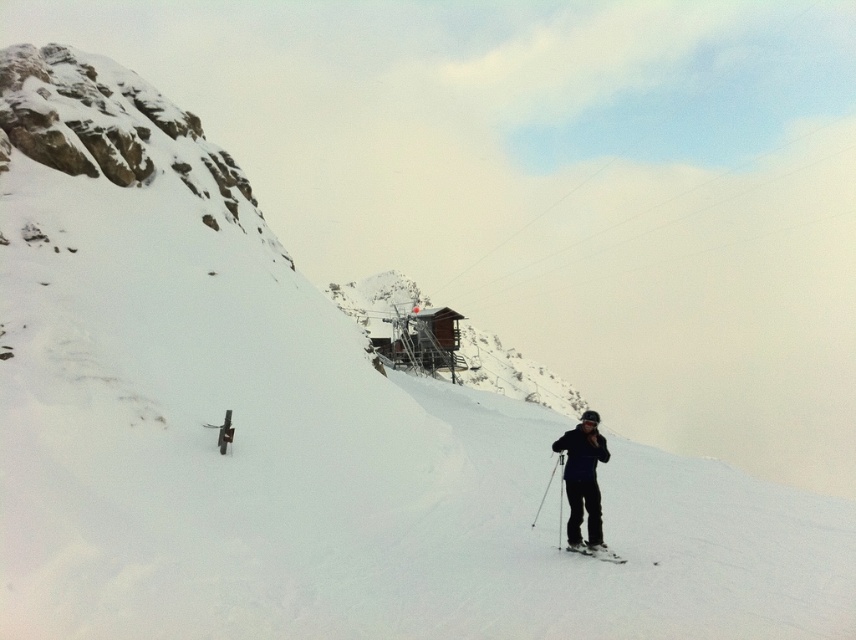
Question: Is matte black ski suit at lower right bigger than white matte ski at lower right?

Choices:
 (A) yes
 (B) no

Answer: (A)

Question: Which object appears closest to the camera in this image?

Choices:
 (A) white matte ski at lower right
 (B) matte black ski suit at lower right

Answer: (A)

Question: Observing the image, what is the correct spatial positioning of matte black ski suit at lower right in reference to white matte ski at lower right?

Choices:
 (A) left
 (B) right

Answer: (B)

Question: Can you confirm if matte black ski suit at lower right is positioned to the right of white matte ski at lower right?

Choices:
 (A) yes
 (B) no

Answer: (A)

Question: Which point appears farthest from the camera in this image?

Choices:
 (A) (571, 550)
 (B) (568, 518)

Answer: (B)

Question: Which object is farther from the camera taking this photo?

Choices:
 (A) white matte ski at lower right
 (B) matte black ski suit at lower right

Answer: (B)